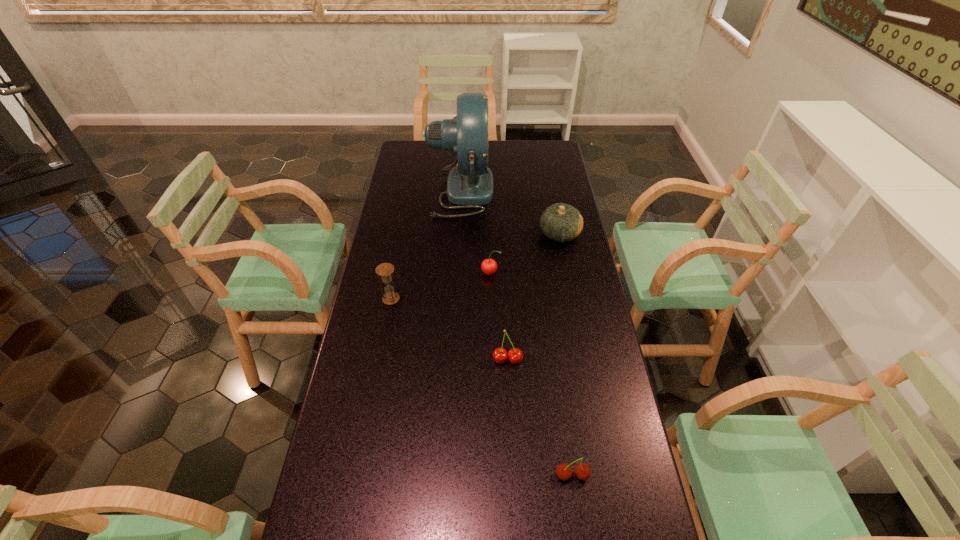
Image resolution: width=960 pixels, height=540 pixels. Find the location of `free space at the left edge of the desktop`. free space at the left edge of the desktop is located at coordinates (402, 370).

Image resolution: width=960 pixels, height=540 pixels. Identify the location of blank space at the right edge of the desktop. (558, 328).

What are the coordinates of `vacant space at the far left corner of the desktop` in the screenshot? It's located at (419, 156).

What are the coordinates of `free space at the far right corner of the desktop` in the screenshot? It's located at (555, 163).

You are a GUI agent. You are given a task and a screenshot of the screen. Output one action in this format:
    pyautogui.click(x=<x>, y=<y>)
    Task: Click on the vacant region between the tallest object and the second farthest object
    Image resolution: width=960 pixels, height=540 pixels.
    Given the screenshot: What is the action you would take?
    (510, 212)

Find the location of a particular element. Image resolution: width=960 pixels, height=540 pixels. vacant region between the rightmost cherry and the gourd is located at coordinates (566, 355).

Identify the location of free area in between the leftmost object and the nearest object. This screenshot has width=960, height=540. (482, 387).

Find the location of a particular element. This screenshot has width=960, height=540. vacant region between the second nearest object and the tallest object is located at coordinates (484, 275).

The width and height of the screenshot is (960, 540). Find the location of `vacant space in between the nearest object and the fifth nearest object`. vacant space in between the nearest object and the fifth nearest object is located at coordinates tap(566, 355).

Where is `free spot between the nearest cherry and the gourd`? free spot between the nearest cherry and the gourd is located at coordinates (566, 355).